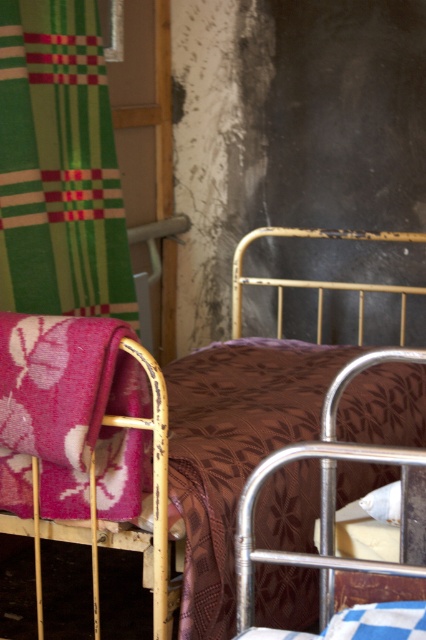
Question: Estimate the real-world distances between objects in this image. Which object is farther from the floral pink fabric at left?

Choices:
 (A) brown floral fabric at center
 (B) brown floral fabric bed at center
 (C) green striped fabric at upper left

Answer: (B)

Question: Estimate the real-world distances between objects in this image. Which object is closer to the brown floral fabric bed at center?

Choices:
 (A) green striped fabric at upper left
 (B) brown floral fabric at center

Answer: (B)

Question: Where is floral pink fabric at left located in relation to brown floral fabric bed at center in the image?

Choices:
 (A) above
 (B) below

Answer: (B)

Question: Can you confirm if brown floral fabric at center is positioned below floral pink fabric at left?

Choices:
 (A) yes
 (B) no

Answer: (A)

Question: Does brown floral fabric at center have a lesser width compared to brown floral fabric bed at center?

Choices:
 (A) yes
 (B) no

Answer: (B)

Question: Which is farther from the brown floral fabric at center?

Choices:
 (A) brown floral fabric bed at center
 (B) floral pink fabric at left
 (C) green striped fabric at upper left

Answer: (C)